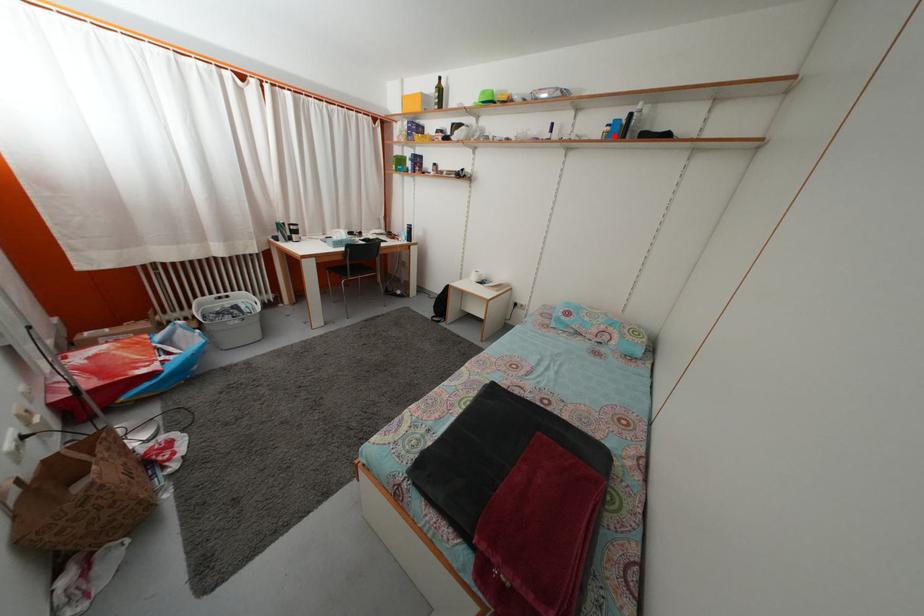
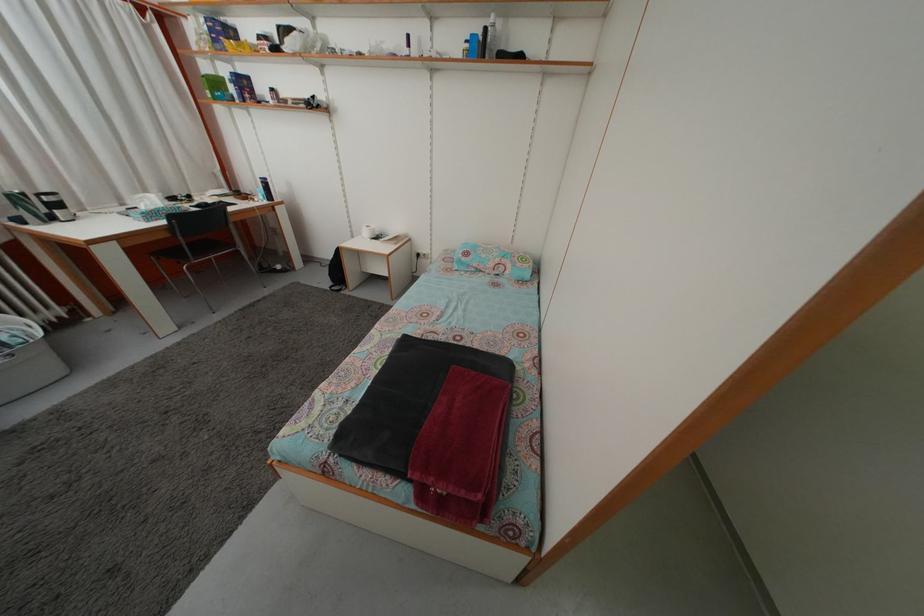
Find the pixel in the second image that matches the highlighted location in the first image.

(473, 53)